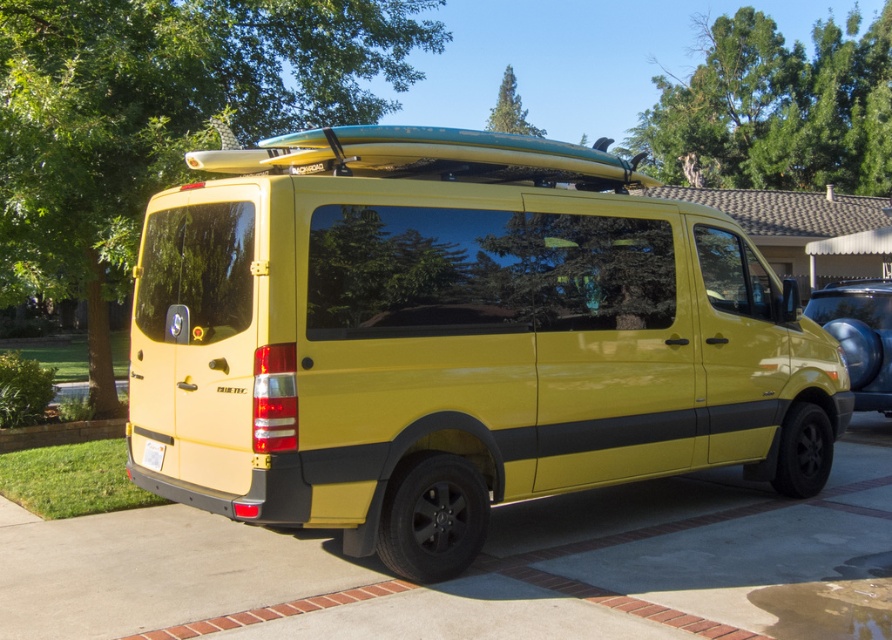
Question: Among these points, which one is farthest from the camera?

Choices:
 (A) (886, 339)
 (B) (158, 442)
 (C) (617, 353)

Answer: (A)

Question: Does glossy yellow van at center have a smaller size compared to metallic blue surfboard at right?

Choices:
 (A) yes
 (B) no

Answer: (A)

Question: Does metallic blue surfboard at right have a larger size compared to white plastic license plate at lower center?

Choices:
 (A) yes
 (B) no

Answer: (A)

Question: Which point is closer to the camera taking this photo?

Choices:
 (A) (158, 284)
 (B) (155, 442)

Answer: (B)

Question: In this image, where is glossy yellow van at center located relative to white plastic license plate at lower center?

Choices:
 (A) above
 (B) below

Answer: (A)

Question: Which object is positioned closest to the glossy yellow van at center?

Choices:
 (A) metallic blue surfboard at right
 (B) white plastic license plate at lower center

Answer: (B)